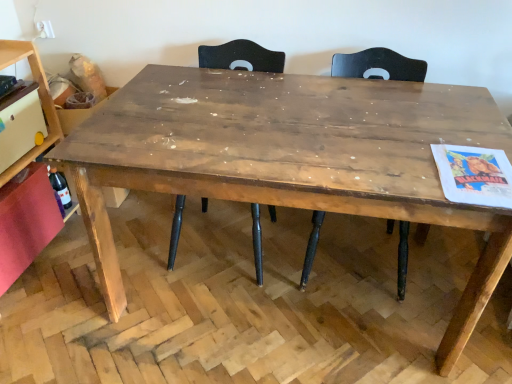
Where is `blank area beneath rustic wood table at center (from a real-world perspective)`? blank area beneath rustic wood table at center (from a real-world perspective) is located at coordinates (290, 300).